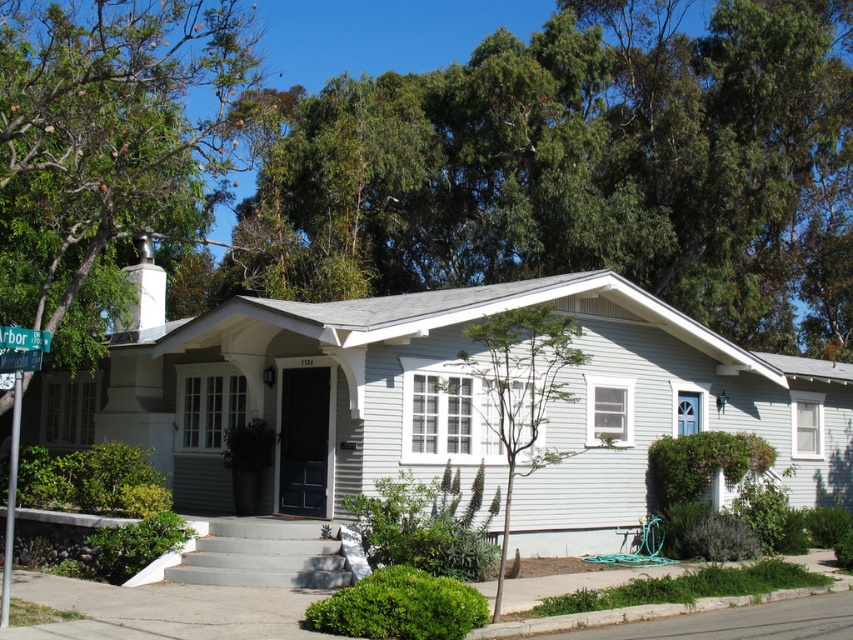
Is point (682, 150) farther from camera compared to point (21, 342)?

Yes, point (682, 150) is farther from viewer.

Is green leafy tree at upper center positioned behind green plastic street sign at upper left?

That is True.

Where is `green leafy tree at upper center`? This screenshot has height=640, width=853. green leafy tree at upper center is located at coordinates (585, 170).

Find the location of a particular element. green leafy tree at upper center is located at coordinates (585, 170).

Which is more to the left, green leafy tree at upper center or green leafy tree at center?

Positioned to the left is green leafy tree at center.

In the scene shown: Is green leafy tree at upper center further to the viewer compared to green leafy tree at center?

That is True.

You are a GUI agent. You are given a task and a screenshot of the screen. Output one action in this format:
    pyautogui.click(x=<x>, y=<y>)
    Task: Click on the green leafy tree at upper center
    This screenshot has height=640, width=853.
    Given the screenshot: What is the action you would take?
    pyautogui.click(x=585, y=170)

Does green leafy tree at center have a smaller size compared to green plastic street sign at left?

No.

In order to click on green leafy tree at center in this screenshot , I will do `click(523, 388)`.